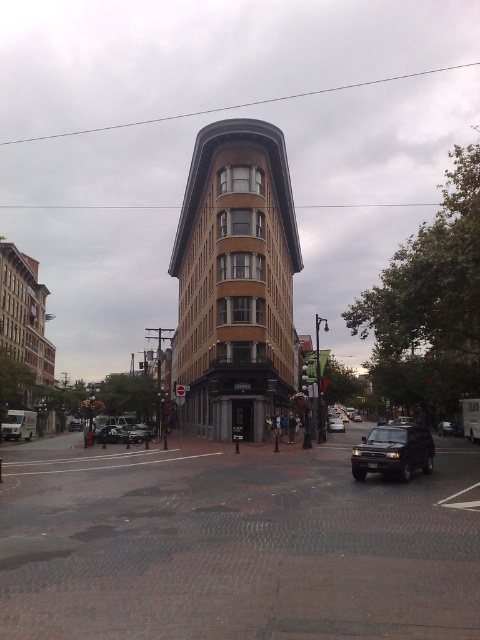
Question: Can you confirm if brick pavement at center is positioned below shiny black suv at lower right?

Choices:
 (A) yes
 (B) no

Answer: (B)

Question: Which point is farther to the camera?

Choices:
 (A) (148, 433)
 (B) (373, 472)
 (C) (183, 508)
 (D) (339, 429)

Answer: (D)

Question: Which object is the closest to the shiny silver sedan at lower left?

Choices:
 (A) brick pavement at center
 (B) shiny black suv at lower right
 (C) shiny black suv at center

Answer: (A)

Question: In this image, where is shiny black suv at lower right located relative to shiny black suv at center?

Choices:
 (A) above
 (B) below

Answer: (A)

Question: Which point is farther to the camera?

Choices:
 (A) shiny silver sedan at lower left
 (B) shiny black suv at center

Answer: (B)

Question: Considering the relative positions of brick pavement at center and shiny silver sedan at lower left in the image provided, where is brick pavement at center located with respect to shiny silver sedan at lower left?

Choices:
 (A) right
 (B) left

Answer: (A)